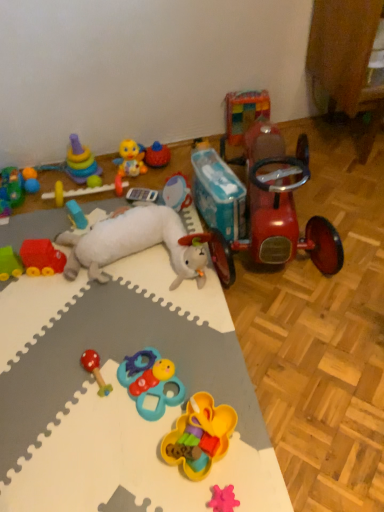
This screenshot has height=512, width=384. What are the coordinates of `free space in front of blue rubber rattle at center, the sixth toy positioned from the right` in the screenshot? It's located at pos(138,456).